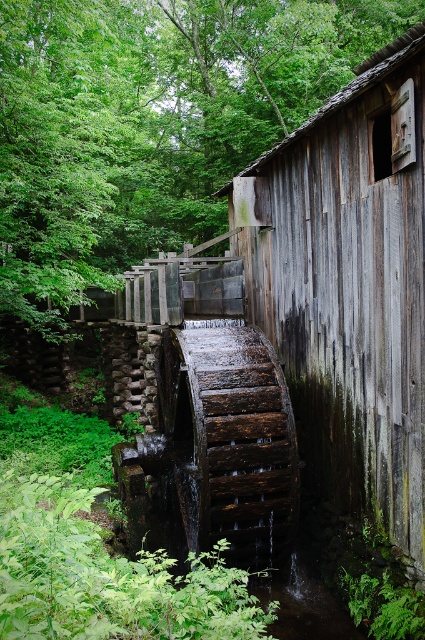
You are a hiker who wants to take a shortcut from the green leafy forest at upper left to the weathered wood hut at center. The path is straight and clear. Your backpack has a 15 meter rope. Can you safely cross the distance using the rope?

The distance between the green leafy forest at upper left and the weathered wood hut at center is 13.84 meters. Since your rope is 15 meters long, it is long enough to safely cross the distance.

Based on the photo, you are standing in front of the weathered wood hut at center and want to look towards the green leafy forest at upper left. In which direction should you turn your head?

The green leafy forest at upper left is positioned on the left side of the weathered wood hut at center, so you should turn your head to the left to look towards it.